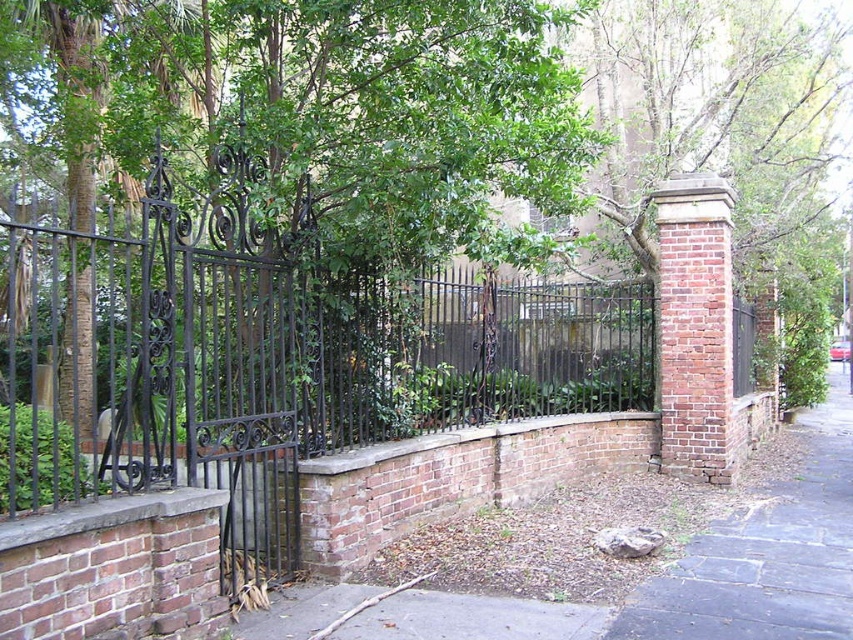
You are standing at the entrance of the residential area and see the black wrought iron fence at center. If you walk straight ahead, will you pass through the fence or go around it?

The black wrought iron fence at center is located at point (x=345, y=369), so walking straight ahead would lead you directly to the fence. Since the fence is at the center, you would need to go around it unless there is an opening. The image shows the gate is partially open, so you can pass through the open part of the fence.

You are a delivery person trying to locate the entrance to a house. You see the black wrought iron fence at center and the brown stone pavement at lower right. Which object is higher up in the image?

The black wrought iron fence at center is higher up in the image than the brown stone pavement at lower right.

You are a delivery person approaching the black wrought iron fence at center and the brown stone pavement at lower right. Which object will you encounter first as you move forward?

You will encounter the black wrought iron fence at center first because it is closer to the viewer than the brown stone pavement at lower right.